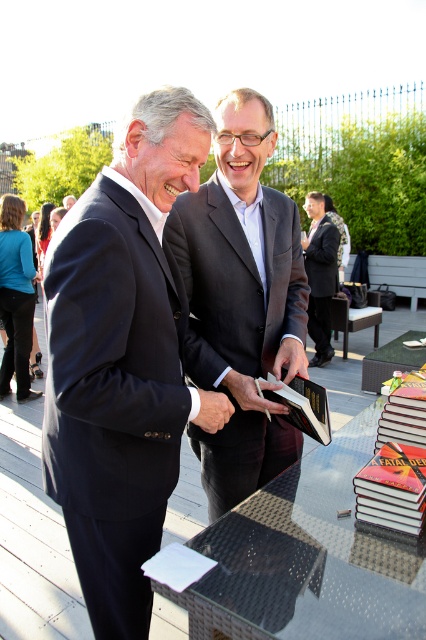
Question: Does matte black suit at center have a larger size compared to hardcover book at center?

Choices:
 (A) no
 (B) yes

Answer: (B)

Question: Is navy blue suit at left positioned in front of matte black suit at center?

Choices:
 (A) no
 (B) yes

Answer: (B)

Question: Can you confirm if navy blue suit at left is bigger than black glass table at center?

Choices:
 (A) yes
 (B) no

Answer: (A)

Question: Estimate the real-world distances between objects in this image. Which object is closer to the navy blue suit at left?

Choices:
 (A) hardcover book at lower right
 (B) hardcover book at center
 (C) black glass table at center
 (D) dark gray suit at center

Answer: (B)

Question: Estimate the real-world distances between objects in this image. Which object is closer to the dark gray suit at center?

Choices:
 (A) black glass table at center
 (B) matte black suit at center
 (C) hardcover book at lower right

Answer: (B)

Question: Based on their relative distances, which object is nearer to the hardcover book at center?

Choices:
 (A) hardcover book at lower right
 (B) black glass table at center
 (C) navy blue suit at left

Answer: (A)